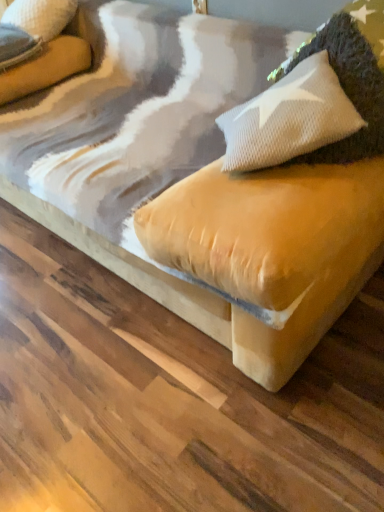
Question: Considering the relative positions of velvet beige pillow at upper left, marked as the second pillow in a bottom-to-top arrangement, and white textured pillow at upper right, acting as the first pillow starting from the front, in the image provided, is velvet beige pillow at upper left, marked as the second pillow in a bottom-to-top arrangement, to the left or to the right of white textured pillow at upper right, acting as the first pillow starting from the front,?

Choices:
 (A) left
 (B) right

Answer: (A)

Question: Does point (46, 10) appear closer or farther from the camera than point (367, 91)?

Choices:
 (A) farther
 (B) closer

Answer: (A)

Question: In the image, is velvet beige pillow at upper left, which is counted as the 1th pillow, starting from the top, positioned in front of or behind white textured pillow at upper right, placed as the 1th pillow when sorted from bottom to top?

Choices:
 (A) behind
 (B) front

Answer: (A)

Question: Is white textured pillow at upper right, the first pillow in the right-to-left sequence, inside or outside of velvet beige pillow at upper left, which is counted as the second pillow, starting from the right?

Choices:
 (A) outside
 (B) inside

Answer: (A)

Question: In the image, is white textured pillow at upper right, acting as the first pillow starting from the front, positioned in front of or behind velvet beige pillow at upper left, which is counted as the second pillow, starting from the right?

Choices:
 (A) front
 (B) behind

Answer: (A)

Question: Considering the positions of point (360, 136) and point (72, 14), is point (360, 136) closer or farther from the camera than point (72, 14)?

Choices:
 (A) farther
 (B) closer

Answer: (B)

Question: Is white textured pillow at upper right, placed as the 1th pillow when sorted from bottom to top, wider or thinner than velvet beige pillow at upper left, marked as the 1th pillow in a back-to-front arrangement?

Choices:
 (A) thin
 (B) wide

Answer: (B)